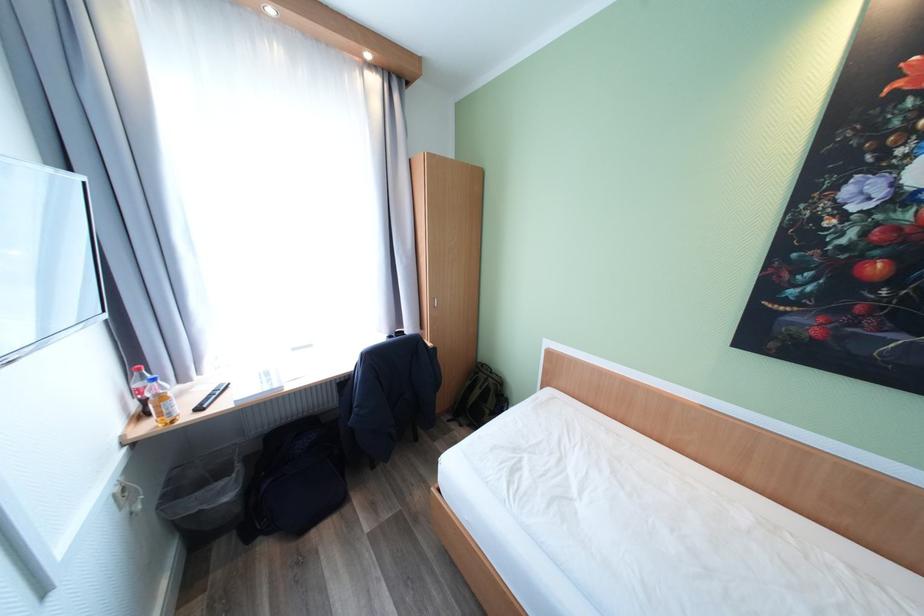
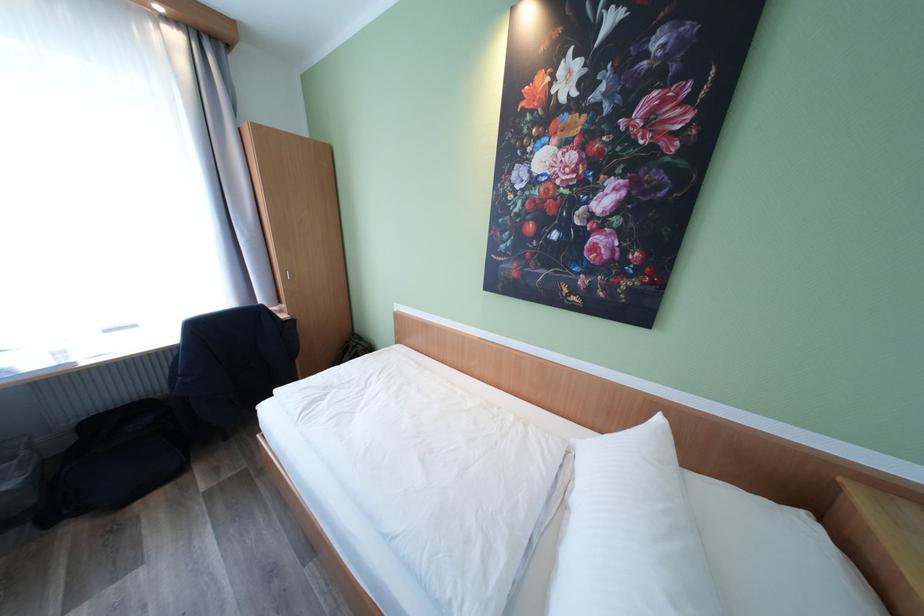
In a continuous first-person perspective shot, in which direction is the camera moving?

The movement direction of the cameraman is right, backward.